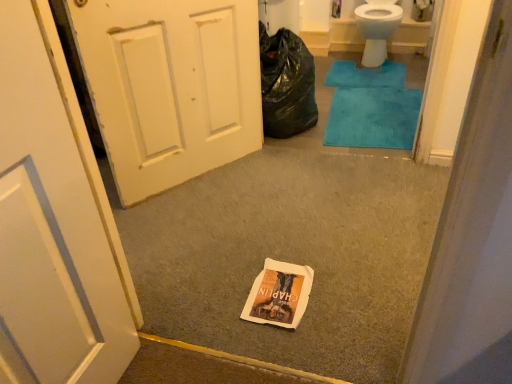
Where is `vacant area on the back side of white paper bag at center`? vacant area on the back side of white paper bag at center is located at coordinates (277, 247).